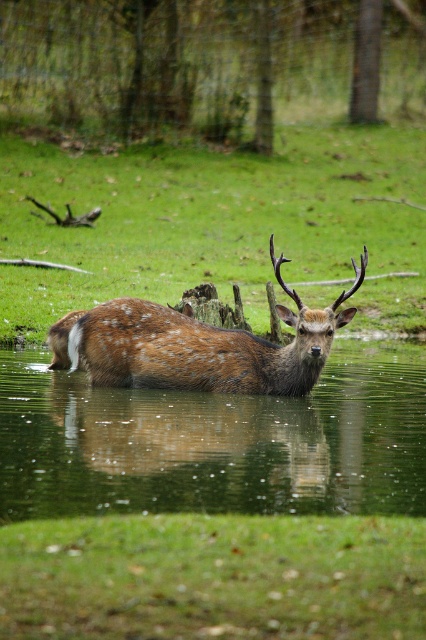
Question: Which point is farther from the camera taking this photo?

Choices:
 (A) (278, 269)
 (B) (49, 323)

Answer: (B)

Question: Is brown textured grass at center behind fawn fur antlered deer at center?

Choices:
 (A) yes
 (B) no

Answer: (A)

Question: Among these objects, which one is farthest from the camera?

Choices:
 (A) brown textured grass at center
 (B) fawn fur antlered deer at center

Answer: (A)

Question: In this image, where is brown textured grass at center located relative to fawn fur antlered deer at center?

Choices:
 (A) right
 (B) left

Answer: (B)

Question: Does brown textured grass at center have a larger size compared to fawn fur antlered deer at center?

Choices:
 (A) no
 (B) yes

Answer: (B)